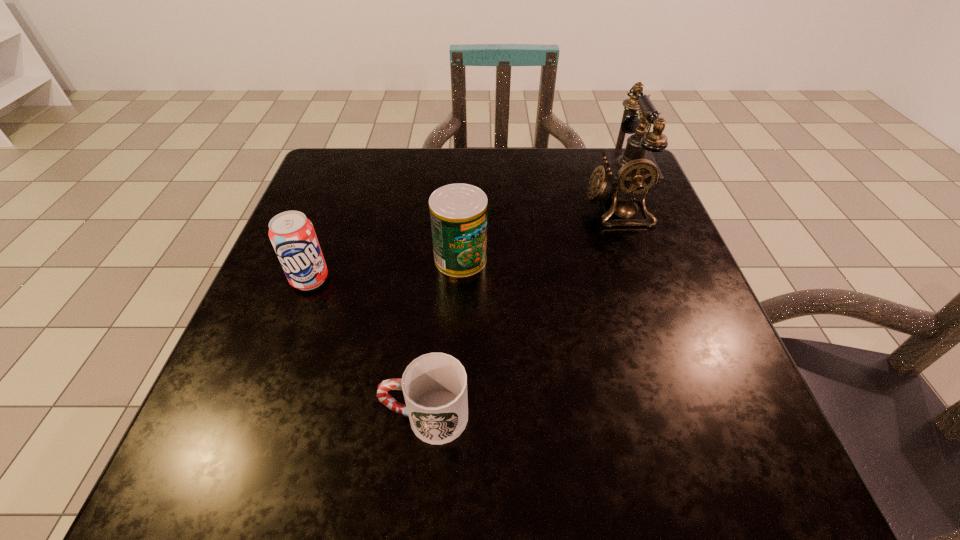
This screenshot has height=540, width=960. I want to click on free space located 0.120m on the front of the leftmost object, so click(x=284, y=349).

Where is `vacant space located 0.090m on the handle side of the nearest object`? vacant space located 0.090m on the handle side of the nearest object is located at coordinates (322, 416).

Identify the location of vacant space situated on the handle side of the nearest object. (238, 416).

Find the location of a particular element. object located at the far edge is located at coordinates (628, 176).

At what (x,y) coordinates should I click in order to perform the action: click on object located in the near edge section of the desktop. Please return your answer as a coordinate pair (x, y). Image resolution: width=960 pixels, height=540 pixels. Looking at the image, I should click on (434, 385).

The height and width of the screenshot is (540, 960). I want to click on object situated at the left edge, so click(x=292, y=235).

Where is `object that is at the right edge`? The image size is (960, 540). object that is at the right edge is located at coordinates (628, 176).

Identify the location of object present at the far right corner. [628, 176].

The width and height of the screenshot is (960, 540). In order to click on free space at the far edge of the desktop in this screenshot , I will do `click(527, 191)`.

Find the location of `vacant space at the near edge`. vacant space at the near edge is located at coordinates (586, 441).